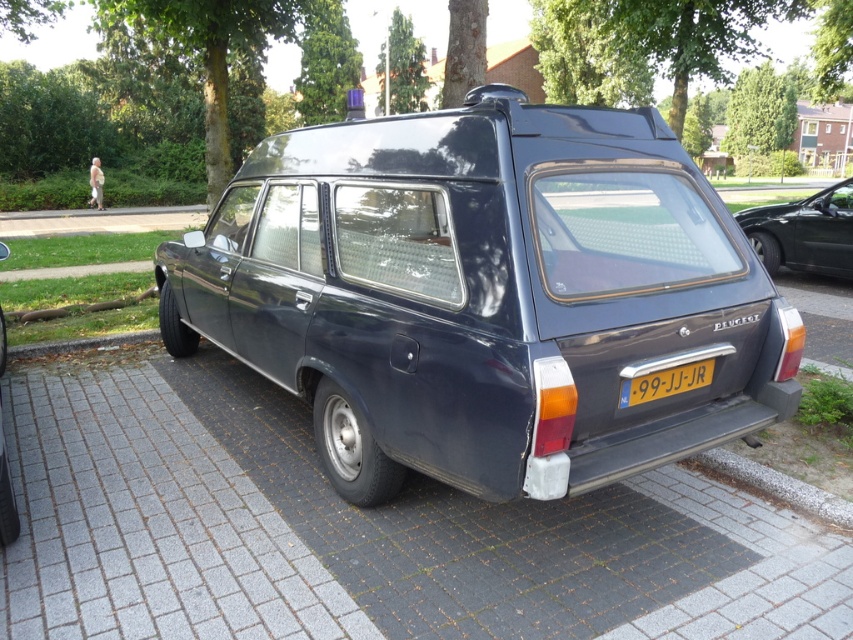
Question: Does matte black minivan at center appear on the right side of yellow metallic license plate at center?

Choices:
 (A) yes
 (B) no

Answer: (B)

Question: Is matte black car at right above yellow metallic license plate at center?

Choices:
 (A) yes
 (B) no

Answer: (A)

Question: Which point appears closest to the camera in this image?

Choices:
 (A) [x=676, y=312]
 (B) [x=844, y=518]
 (C) [x=631, y=394]
 (D) [x=740, y=221]

Answer: (C)

Question: Which object appears farthest from the camera in this image?

Choices:
 (A) matte black minivan at center
 (B) matte black car at right
 (C) yellow metallic license plate at center

Answer: (B)

Question: Which of the following is the closest to the observer?

Choices:
 (A) (547, 128)
 (B) (637, 396)
 (C) (827, 225)

Answer: (B)

Question: Does matte black minivan at center have a smaller size compared to gray concrete curb at lower right?

Choices:
 (A) yes
 (B) no

Answer: (B)